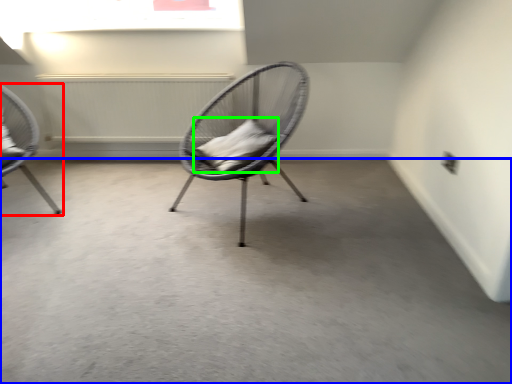
Question: Based on their relative distances, which object is nearer to chair (highlighted by a red box)? Choose from concrete (highlighted by a blue box) and pillow (highlighted by a green box).

Choices:
 (A) concrete
 (B) pillow

Answer: (B)